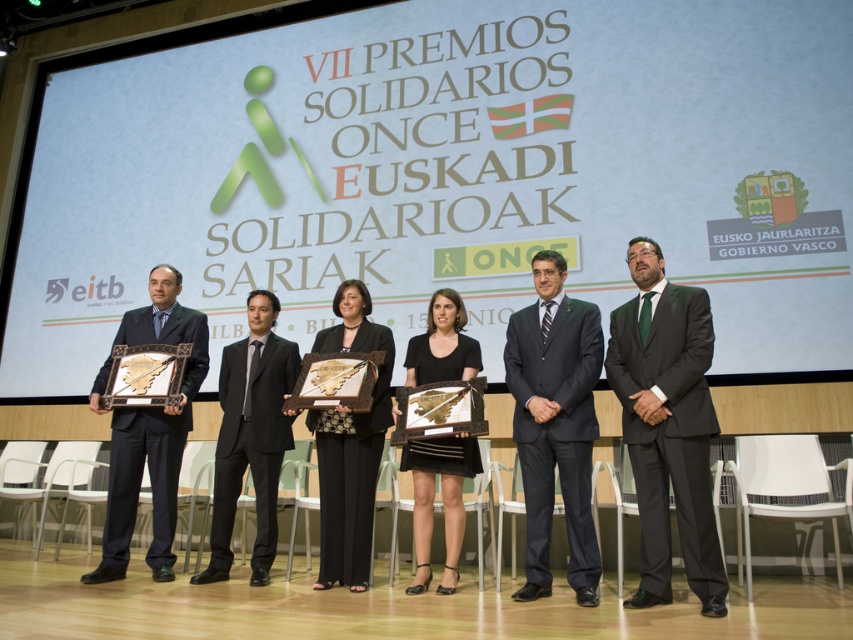
You are an event photographer at the VII PREMIOS SOLIDARIOS ONCE EUSKADI SOLIDARIOAK SARIAK. You need to capture a photo where the matte gold frame at left and the black textured dress at center are both visible. Considering their heights, which object will appear taller in the photo?

The matte gold frame at left will appear taller in the photo because it is taller than the black textured dress at center according to the description.